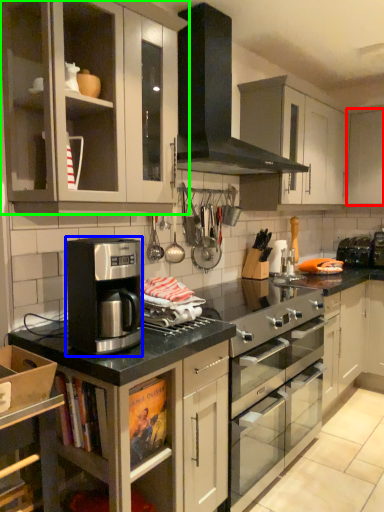
Question: Considering the real-world distances, which object is farthest from cabinetry (highlighted by a red box)? kitchen appliance (highlighted by a blue box) or cabinetry (highlighted by a green box)?

Choices:
 (A) kitchen appliance
 (B) cabinetry

Answer: (A)